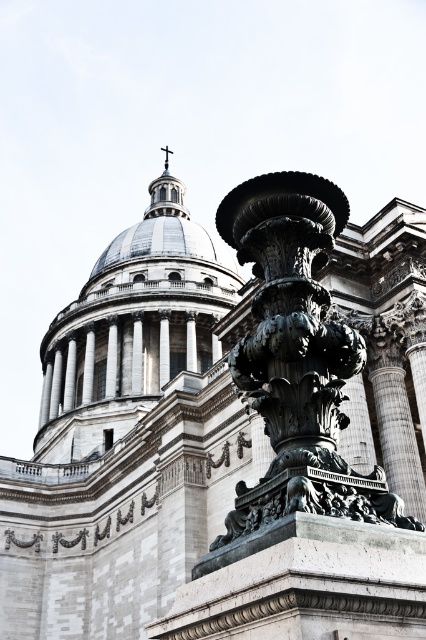
Question: Based on their relative distances, which object is nearer to the white marble dome at upper center?

Choices:
 (A) polished bronze fountain at center
 (B) metallic cross at upper center

Answer: (A)

Question: Which object is closer to the camera taking this photo?

Choices:
 (A) metallic cross at upper center
 (B) white marble dome at upper center

Answer: (B)

Question: Can you confirm if white marble dome at upper center is bigger than metallic cross at upper center?

Choices:
 (A) yes
 (B) no

Answer: (A)

Question: Does white marble dome at upper center appear under metallic cross at upper center?

Choices:
 (A) yes
 (B) no

Answer: (A)

Question: Which point is closer to the camera?

Choices:
 (A) metallic cross at upper center
 (B) white marble dome at upper center

Answer: (B)

Question: Is the position of polished bronze fountain at center more distant than that of metallic cross at upper center?

Choices:
 (A) no
 (B) yes

Answer: (A)